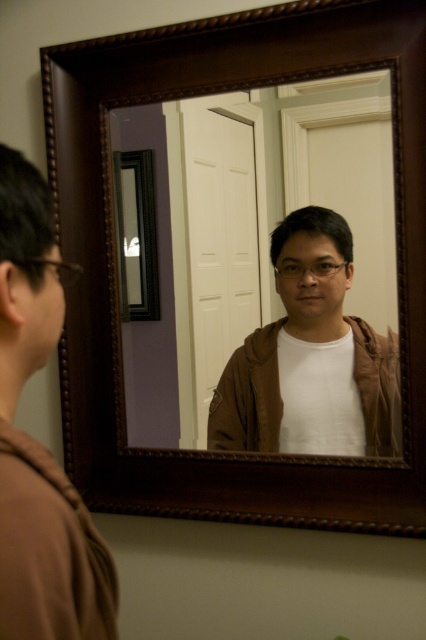
Does brown matte jacket at lower left have a smaller size compared to brown matte jacket at center?

Indeed, brown matte jacket at lower left has a smaller size compared to brown matte jacket at center.

Is brown matte jacket at lower left above brown matte jacket at center?

Yes, brown matte jacket at lower left is above brown matte jacket at center.

Does point (23, 513) lie in front of point (357, 372)?

Yes, it is.

You are a GUI agent. You are given a task and a screenshot of the screen. Output one action in this format:
    pyautogui.click(x=<x>, y=<y>)
    Task: Click on the brown matte jacket at lower left
    
    Given the screenshot: What is the action you would take?
    pyautogui.click(x=39, y=442)

Does brown wooden mirror at center have a greater height compared to brown matte jacket at lower left?

Correct, brown wooden mirror at center is much taller as brown matte jacket at lower left.

Between point (344, 404) and point (37, 577), which one is positioned in front?

Point (37, 577) is in front.

Does point (294, 448) come farther from viewer compared to point (66, 269)?

Yes.

You are a GUI agent. You are given a task and a screenshot of the screen. Output one action in this format:
    pyautogui.click(x=<x>, y=<y>)
    Task: Click on the brown wooden mirror at center
    
    Given the screenshot: What is the action you would take?
    pyautogui.click(x=275, y=276)

Is brown wooden mirror at center wider than brown matte jacket at center?

Correct, the width of brown wooden mirror at center exceeds that of brown matte jacket at center.

Measure the distance between point (195, 310) and camera.

1.48 meters

At what (x,y) coordinates should I click in order to perform the action: click on brown wooden mirror at center. Please return your answer as a coordinate pair (x, y). Looking at the image, I should click on (275, 276).